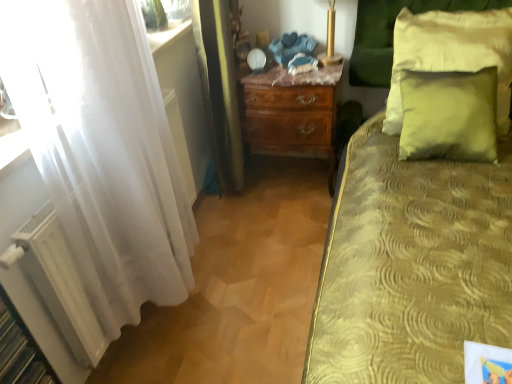
Image resolution: width=512 pixels, height=384 pixels. What do you see at coordinates (449, 115) in the screenshot? I see `green velvet pillow at upper right, the second pillow positioned from the top` at bounding box center [449, 115].

Image resolution: width=512 pixels, height=384 pixels. I want to click on white matte radiator at lower left, so click(20, 350).

Where is `mahogany wood nightstand at center`? The height and width of the screenshot is (384, 512). mahogany wood nightstand at center is located at coordinates (291, 111).

From their relative heights in the image, would you say white matte radiator at lower left is taller or shorter than mahogany wood nightstand at center?

In the image, white matte radiator at lower left appears to be shorter than mahogany wood nightstand at center.

Consider the image. From the image's perspective, is white matte radiator at lower left beneath mahogany wood nightstand at center?

Yes, from the image's perspective, white matte radiator at lower left is below mahogany wood nightstand at center.

Considering the sizes of objects white matte radiator at lower left and mahogany wood nightstand at center in the image provided, who is bigger, white matte radiator at lower left or mahogany wood nightstand at center?

Bigger between the two is mahogany wood nightstand at center.

Considering the sizes of white matte radiator at lower left and mahogany wood nightstand at center in the image, is white matte radiator at lower left wider or thinner than mahogany wood nightstand at center?

In the image, white matte radiator at lower left appears to be more narrow than mahogany wood nightstand at center.

This screenshot has width=512, height=384. Find the location of `nightstand behind the white sheer curtain at left`. nightstand behind the white sheer curtain at left is located at coordinates (291, 111).

Is the depth of mahogany wood nightstand at center greater than that of white sheer curtain at left?

Yes.

Is white sheer curtain at left located within mahogany wood nightstand at center?

No, white sheer curtain at left is not surrounded by mahogany wood nightstand at center.

Is point (322, 149) less distant than point (29, 27)?

No, (322, 149) is behind (29, 27).

From a real-world perspective, which object rests below the other?

A: In real-world perspective, white matte radiator at lower left is lower.

You are a GUI agent. You are given a task and a screenshot of the screen. Output one action in this format:
    pyautogui.click(x=<x>, y=<y>)
    Task: Click on the curtain that appears above the white matte radiator at lower left (from a real-world perspective)
    The image size is (512, 384).
    Given the screenshot: What is the action you would take?
    pyautogui.click(x=102, y=155)

From the image's perspective, is white matte radiator at lower left above or below white sheer curtain at left?

Clearly, from the image's perspective, white matte radiator at lower left is below white sheer curtain at left.

How different are the orientations of white matte radiator at lower left and white sheer curtain at left in degrees?

They differ by 0.0703 degrees in their facing directions.

Does point (407, 145) come farther from viewer compared to point (24, 345)?

Yes.

Between green velvet pillow at upper right, which appears as the first pillow when ordered from the bottom, and white matte radiator at lower left, which one has larger width?

With larger width is white matte radiator at lower left.

Is white sheer curtain at left positioned far away from mahogany wood nightstand at center?

That's right, there is a large distance between white sheer curtain at left and mahogany wood nightstand at center.

This screenshot has height=384, width=512. I want to click on nightstand that is on the right side of white sheer curtain at left, so click(291, 111).

From a real-world perspective, is white sheer curtain at left positioned above or below mahogany wood nightstand at center?

Clearly, from a real-world perspective, white sheer curtain at left is above mahogany wood nightstand at center.

Considering the points (247, 135) and (396, 116), which point is in front, point (247, 135) or point (396, 116)?

The point (396, 116) is closer.

Consider the image. Can you confirm if mahogany wood nightstand at center is smaller than green velvet pillow at upper right, which is counted as the second pillow, starting from the bottom?

Actually, mahogany wood nightstand at center might be larger than green velvet pillow at upper right, which is counted as the second pillow, starting from the bottom.

Where is `the 2nd pillow above the mahogany wood nightstand at center (from the image's perspective)`? Image resolution: width=512 pixels, height=384 pixels. the 2nd pillow above the mahogany wood nightstand at center (from the image's perspective) is located at coordinates (451, 53).

Is the surface of mahogany wood nightstand at center in direct contact with green velvet pillow at upper right, which is counted as the second pillow, starting from the bottom?

No, mahogany wood nightstand at center is not beside green velvet pillow at upper right, which is counted as the second pillow, starting from the bottom.

Considering the relative sizes of white sheer curtain at left and green velvet pillow at upper right, the second pillow positioned from the top, in the image provided, is white sheer curtain at left shorter than green velvet pillow at upper right, the second pillow positioned from the top,?

No.

Considering the positions of objects white sheer curtain at left and green velvet pillow at upper right, which appears as the first pillow when ordered from the bottom, in the image provided, who is more to the left, white sheer curtain at left or green velvet pillow at upper right, which appears as the first pillow when ordered from the bottom,?

white sheer curtain at left is more to the left.

Looking at this image, from the image's perspective, is white sheer curtain at left under green velvet pillow at upper right, which appears as the first pillow when ordered from the bottom?

Yes, from the image's perspective, white sheer curtain at left is beneath green velvet pillow at upper right, which appears as the first pillow when ordered from the bottom.

Could you tell me if white sheer curtain at left is turned towards green velvet pillow at upper right, the second pillow positioned from the top?

No, white sheer curtain at left is not facing towards green velvet pillow at upper right, the second pillow positioned from the top.

Identify the location of shelf lying on the left of mahogany wood nightstand at center. pyautogui.click(x=20, y=350).

This screenshot has height=384, width=512. Identify the location of nightstand above the white sheer curtain at left (from the image's perspective). (291, 111).

From the image, which object appears to be nearer to white sheer curtain at left, mahogany wood nightstand at center or white matte radiator at lower left?

Based on the image, white matte radiator at lower left appears to be nearer to white sheer curtain at left.

Which object lies further to the anchor point green velvet pillow at upper right, which appears as the first pillow when ordered from the bottom, white sheer curtain at left or white matte radiator at lower left?

The object further to green velvet pillow at upper right, which appears as the first pillow when ordered from the bottom, is white matte radiator at lower left.

When comparing their distances from white matte radiator at lower left, does white sheer curtain at left or mahogany wood nightstand at center seem further?

Among the two, mahogany wood nightstand at center is located further to white matte radiator at lower left.

Based on their spatial positions, is white matte radiator at lower left or green velvet pillow at upper right, which appears as the first pillow when ordered from the bottom, further from green velvet pillow at upper right, the first pillow positioned from the top?

white matte radiator at lower left lies further to green velvet pillow at upper right, the first pillow positioned from the top, than the other object.

When comparing their distances from white matte radiator at lower left, does green velvet pillow at upper right, the second pillow positioned from the top, or green velvet pillow at upper right, the first pillow positioned from the top, seem closer?

The object closer to white matte radiator at lower left is green velvet pillow at upper right, the second pillow positioned from the top.

When comparing their distances from white sheer curtain at left, does white matte radiator at lower left or mahogany wood nightstand at center seem further?

mahogany wood nightstand at center.

Based on their spatial positions, is green velvet pillow at upper right, the first pillow positioned from the top, or mahogany wood nightstand at center closer to green velvet pillow at upper right, the second pillow positioned from the top?

green velvet pillow at upper right, the first pillow positioned from the top, is closer to green velvet pillow at upper right, the second pillow positioned from the top.

Considering their positions, is green velvet pillow at upper right, the second pillow positioned from the top, positioned closer to green velvet pillow at upper right, which is counted as the second pillow, starting from the bottom, than white sheer curtain at left?

Among the two, green velvet pillow at upper right, the second pillow positioned from the top, is located nearer to green velvet pillow at upper right, which is counted as the second pillow, starting from the bottom.

Find the location of a particular element. The width and height of the screenshot is (512, 384). curtain between white matte radiator at lower left and green velvet pillow at upper right, the first pillow positioned from the top, from left to right is located at coordinates (102, 155).

I want to click on nightstand between white matte radiator at lower left and green velvet pillow at upper right, the first pillow positioned from the top, in the horizontal direction, so click(x=291, y=111).

The height and width of the screenshot is (384, 512). Find the location of `nightstand between white matte radiator at lower left and green velvet pillow at upper right, the second pillow positioned from the top, in the horizontal direction`. nightstand between white matte radiator at lower left and green velvet pillow at upper right, the second pillow positioned from the top, in the horizontal direction is located at coordinates (291, 111).

What are the coordinates of `nightstand between white sheer curtain at left and green velvet pillow at upper right, the first pillow positioned from the top` in the screenshot? It's located at (291, 111).